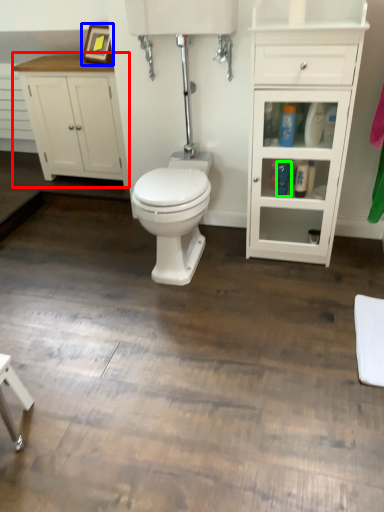
Question: Estimate the real-world distances between objects in this image. Which object is closer to bathroom cabinet (highlighted by a red box), picture frame (highlighted by a blue box) or toiletry (highlighted by a green box)?

Choices:
 (A) picture frame
 (B) toiletry

Answer: (A)